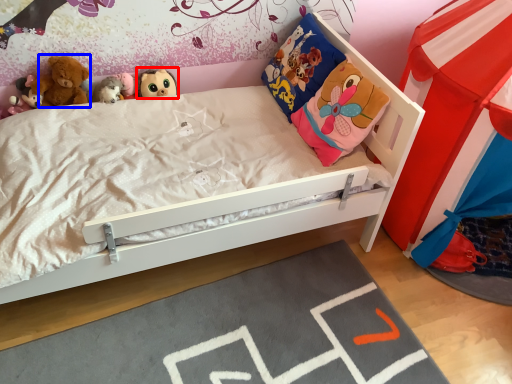
Question: Which object appears farthest to the camera in this image, toy (highlighted by a red box) or doll (highlighted by a blue box)?

Choices:
 (A) toy
 (B) doll

Answer: (A)